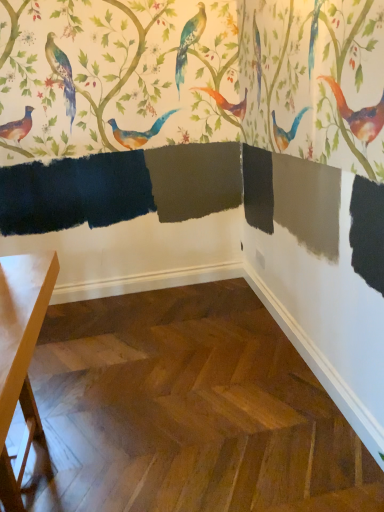
This screenshot has height=512, width=384. Find the location of `light wood table at lower left`. light wood table at lower left is located at coordinates [x=20, y=355].

What do you see at coordinates (20, 355) in the screenshot? I see `light wood table at lower left` at bounding box center [20, 355].

Consider the image. Measure the distance between light wood table at lower left and camera.

A distance of 26.50 inches exists between light wood table at lower left and camera.

Identify the location of light wood table at lower left. (20, 355).